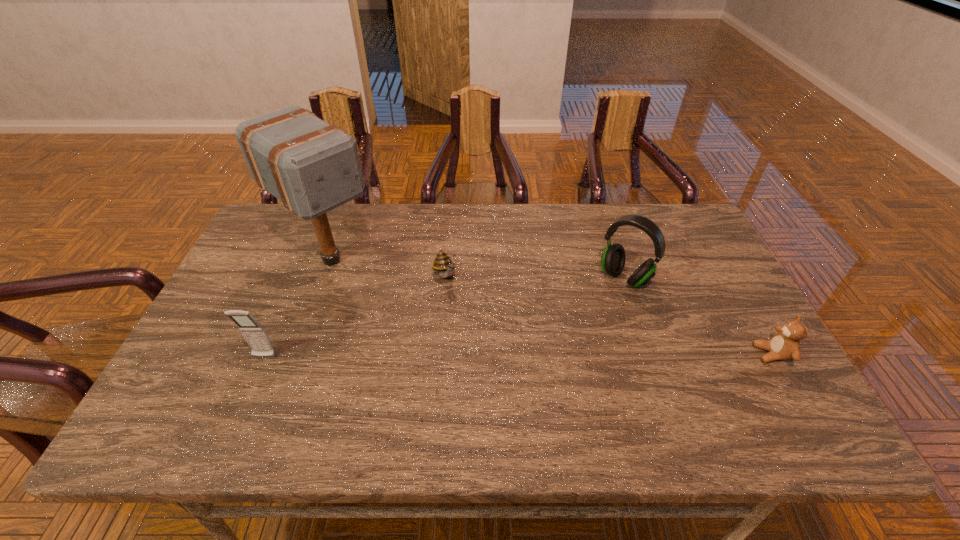
Identify the location of free space at the near right corner of the desktop. coord(721,379).

This screenshot has height=540, width=960. I want to click on free point between the cellular telephone and the mallet, so click(x=298, y=308).

Locate an element on the screen. The height and width of the screenshot is (540, 960). free point between the second object from right to left and the cellular telephone is located at coordinates (444, 318).

Identify the location of blank region between the rightmost object and the cellular telephone. This screenshot has height=540, width=960. 518,356.

The height and width of the screenshot is (540, 960). In order to click on vacant area that lies between the headset and the teddy bear in this screenshot , I will do `click(698, 316)`.

Locate an element on the screen. The width and height of the screenshot is (960, 540). empty space that is in between the teddy bear and the mallet is located at coordinates (552, 307).

The image size is (960, 540). Find the location of `vacant space in between the cellular telephone and the teddy bear`. vacant space in between the cellular telephone and the teddy bear is located at coordinates (518, 356).

Where is `blank region between the third object from left to right and the rightmost object`? blank region between the third object from left to right and the rightmost object is located at coordinates (609, 315).

This screenshot has width=960, height=540. What are the coordinates of `vacant space in between the teddy bear and the snail` in the screenshot? It's located at (609, 315).

The height and width of the screenshot is (540, 960). Identify the location of empty space that is in between the third object from right to left and the headset. (535, 277).